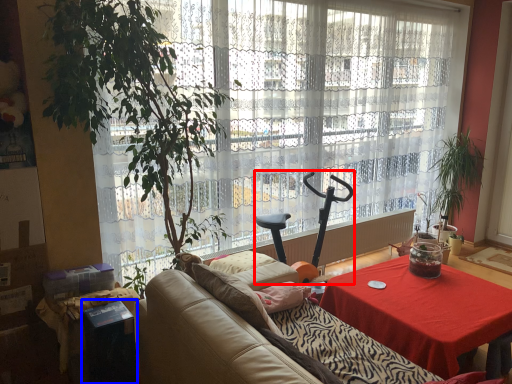
Question: Which point is closer to the camera, swivel chair (highlighted by a red box) or cocktail table (highlighted by a blue box)?

Choices:
 (A) swivel chair
 (B) cocktail table

Answer: (B)